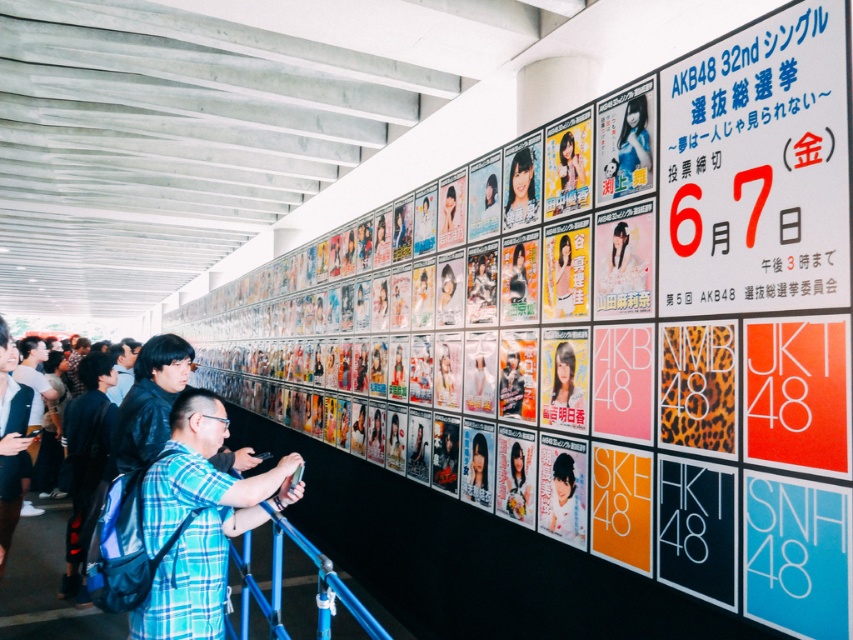
You are an event organizer planning to take a photo of the matte pink poster at center and the matte black jacket at center. Since both are at the center, how can you ensure both are clearly visible in the photo?

The matte pink poster at center is in front of the matte black jacket at center, so to ensure both are clearly visible, position yourself or the camera so that you can see around or behind the matte pink poster at center to include the matte black jacket at center in the frame.

You are standing in the public space and want to find the matte plastic poster at center. According to the grid layout of the posters on the wall, which coordinate point should you look at to locate it?

The matte plastic poster at center is located at point (521,189), so you should look at that coordinate point to find it.